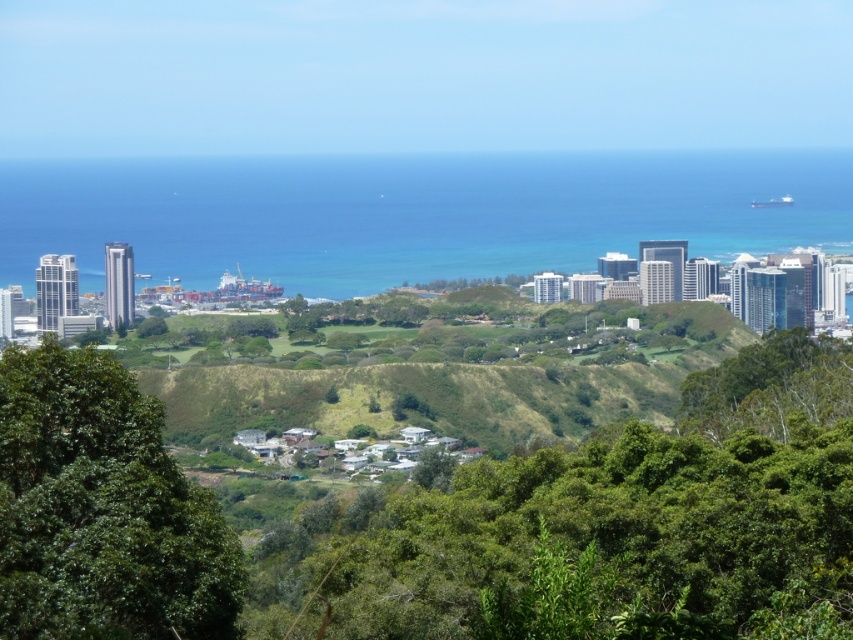
Question: Which of the following is the closest to the observer?

Choices:
 (A) blue water at center
 (B) green leafy tree at center-left

Answer: (A)

Question: Which of the following is the closest to the observer?

Choices:
 (A) (115, 449)
 (B) (807, 184)
 (C) (471, 513)

Answer: (C)

Question: Which point is closer to the camera?

Choices:
 (A) 648,560
 (B) 38,392

Answer: (A)

Question: Is green leafy trees at center thinner than green leafy tree at center-left?

Choices:
 (A) yes
 (B) no

Answer: (B)

Question: Considering the relative positions of blue water at center and green leafy tree at center-left in the image provided, where is blue water at center located with respect to green leafy tree at center-left?

Choices:
 (A) below
 (B) above

Answer: (B)

Question: Is blue water at center positioned before green leafy tree at center-left?

Choices:
 (A) yes
 (B) no

Answer: (A)